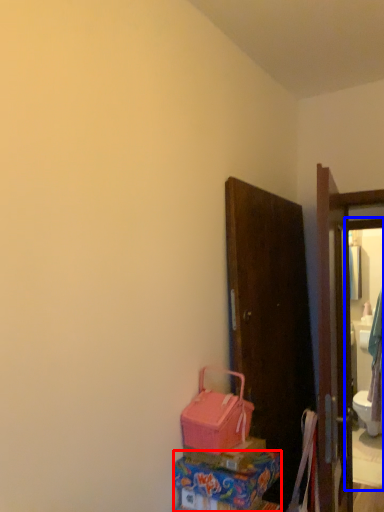
Question: Which object is closer to the camera taking this photo, box (highlighted by a red box) or mirror (highlighted by a blue box)?

Choices:
 (A) box
 (B) mirror

Answer: (A)